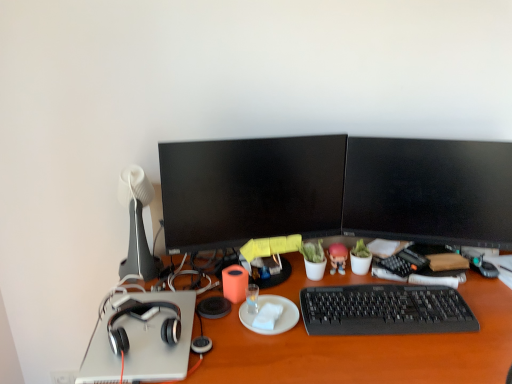
Image resolution: width=512 pixels, height=384 pixels. What do you see at coordinates (367, 350) in the screenshot?
I see `black matte headphones at left` at bounding box center [367, 350].

I want to click on black glossy monitor at right, which is counted as the 2th television, starting from the left, so click(x=429, y=191).

The width and height of the screenshot is (512, 384). Describe the element at coordinates (234, 283) in the screenshot. I see `orange matte cup at center` at that location.

Identify the location of orange matte cup at center. (234, 283).

Identify the location of black matte keyboard at lower right. pos(385,310).

From the image's perspective, which object appears higher, black matte keyboard at lower right or white matte plate at center?

black matte keyboard at lower right appears higher in the image.

Which is behind, point (345, 307) or point (266, 297)?

The point (266, 297) is farther.

Is black matte keyboard at lower right next to white matte plate at center and touching it?

black matte keyboard at lower right and white matte plate at center are not in contact.

Is black glossy monitor at center, the second television when ordered from right to left, inside the boundaries of white matte lamp at left, or outside?

black glossy monitor at center, the second television when ordered from right to left, is not inside white matte lamp at left, it's outside.

Consider the image. Considering the relative sizes of black glossy monitor at center, the second television when ordered from right to left, and white matte lamp at left in the image provided, is black glossy monitor at center, the second television when ordered from right to left, wider than white matte lamp at left?

Incorrect, the width of black glossy monitor at center, the second television when ordered from right to left, does not surpass that of white matte lamp at left.

Does point (125, 198) come in front of point (456, 318)?

That is False.

Is white matte lamp at left facing towards black matte keyboard at lower right?

No, white matte lamp at left is not aimed at black matte keyboard at lower right.

Are white matte lamp at left and black matte keyboard at lower right far apart?

Actually, white matte lamp at left and black matte keyboard at lower right are a little close together.

From a real-world perspective, which is physically below, white matte lamp at left or black matte keyboard at lower right?

black matte keyboard at lower right, from a real-world perspective.

Considering the relative sizes of black glossy monitor at center, the second television when ordered from right to left, and white matte plate at center in the image provided, is black glossy monitor at center, the second television when ordered from right to left, bigger than white matte plate at center?

Correct, black glossy monitor at center, the second television when ordered from right to left, is larger in size than white matte plate at center.

From the image's perspective, does black glossy monitor at center, the second television when ordered from right to left, appear lower than white matte plate at center?

Incorrect, from the image's perspective, black glossy monitor at center, the second television when ordered from right to left, is higher than white matte plate at center.

Does black glossy monitor at center, which is counted as the 1th television, starting from the left, turn towards white matte plate at center?

No, black glossy monitor at center, which is counted as the 1th television, starting from the left, is not aimed at white matte plate at center.

Is black glossy monitor at center, which is counted as the 1th television, starting from the left, in contact with white matte plate at center?

They are not placed beside each other.

Who is smaller, white matte notepad at center or black glossy monitor at center, the second television when ordered from right to left?

Smaller between the two is white matte notepad at center.

I want to click on the 1st television positioned above the white matte notepad at center (from the image's perspective), so click(250, 190).

From the image's perspective, relative to black glossy monitor at center, the second television when ordered from right to left, is white matte notepad at center above or below?

From the image's perspective, white matte notepad at center appears below black glossy monitor at center, the second television when ordered from right to left.

How different are the orientations of white matte notepad at center and black glossy monitor at center, the second television when ordered from right to left, in degrees?

37.1 degrees.

Is white matte lamp at left smaller than black matte headphones at left?

Incorrect, white matte lamp at left is not smaller in size than black matte headphones at left.

Is white matte lamp at left positioned far away from black matte headphones at left?

white matte lamp at left is actually quite close to black matte headphones at left.

Considering the relative positions of white matte lamp at left and black matte headphones at left in the image provided, is white matte lamp at left behind black matte headphones at left?

Yes, white matte lamp at left is further from the viewer.

Would you say white matte lamp at left is outside black matte headphones at left?

Yes.

From a real-world perspective, is orange matte cup at center on top of black matte headphones at left?

No.

Does orange matte cup at center contain black matte headphones at left?

No, black matte headphones at left is located outside of orange matte cup at center.

Which of these two, orange matte cup at center or black matte headphones at left, is bigger?

black matte headphones at left is bigger.

Find the location of a particular element. Image resolution: width=512 pixels, height=384 pixels. computer keyboard above the white matte plate at center (from the image's perspective) is located at coordinates (385, 310).

You are a GUI agent. You are given a task and a screenshot of the screen. Output one action in this format:
    pyautogui.click(x=<x>, y=<y>)
    Task: Click on the lamp that appears behind the black glossy monitor at center, which is counted as the 1th television, starting from the left
    The width and height of the screenshot is (512, 384).
    Given the screenshot: What is the action you would take?
    pyautogui.click(x=137, y=225)

Based on their spatial positions, is orange matte cup at center or white matte plate at center closer to black glossy monitor at right, arranged as the 1th television when viewed from the right?

white matte plate at center is closer to black glossy monitor at right, arranged as the 1th television when viewed from the right.

Looking at the image, which one is located closer to white matte lamp at left, white matte notepad at center or black matte headphones at left?

black matte headphones at left is positioned closer to the anchor white matte lamp at left.

Estimate the real-world distances between objects in this image. Which object is further from black glossy monitor at right, which is counted as the 2th television, starting from the left, black glossy monitor at center, which is counted as the 1th television, starting from the left, or white matte plate at center?

Among the two, white matte plate at center is located further to black glossy monitor at right, which is counted as the 2th television, starting from the left.

Which object lies nearer to the anchor point black glossy monitor at right, which is counted as the 2th television, starting from the left, pink glossy figurine at center or black glossy monitor at center, which is counted as the 1th television, starting from the left?

black glossy monitor at center, which is counted as the 1th television, starting from the left, lies closer to black glossy monitor at right, which is counted as the 2th television, starting from the left, than the other object.

Considering their positions, is black glossy monitor at center, the second television when ordered from right to left, positioned further to orange matte cup at center than black matte headphones at left?

The object further to orange matte cup at center is black glossy monitor at center, the second television when ordered from right to left.

From the picture: From the image, which object appears to be nearer to black glossy monitor at center, which is counted as the 1th television, starting from the left, black matte headphones at left or white matte lamp at left?

white matte lamp at left.

Estimate the real-world distances between objects in this image. Which object is further from black matte headphones at left, black glossy monitor at right, arranged as the 1th television when viewed from the right, or pink glossy figurine at center?

Among the two, black glossy monitor at right, arranged as the 1th television when viewed from the right, is located further to black matte headphones at left.

Considering their positions, is black glossy monitor at right, arranged as the 1th television when viewed from the right, positioned further to orange matte cup at center than white matte notepad at center?

black glossy monitor at right, arranged as the 1th television when viewed from the right, is further to orange matte cup at center.

Identify the location of desk located between orange matte cup at center and black matte keyboard at lower right in the left-right direction. (367, 350).

You are a GUI agent. You are given a task and a screenshot of the screen. Output one action in this format:
    pyautogui.click(x=<x>, y=<y>)
    Task: Click on the plate between orange matte cup at center and black matte headphones at left from left to right
    
    Given the screenshot: What is the action you would take?
    pyautogui.click(x=277, y=320)

Identify the location of stationery located between white matte lamp at left and black matte headphones at left in the left-right direction. Image resolution: width=512 pixels, height=384 pixels. (234, 283).

The height and width of the screenshot is (384, 512). Find the location of `notepad between black matte headphones at left and pink glossy figurine at center from front to back`. notepad between black matte headphones at left and pink glossy figurine at center from front to back is located at coordinates (267, 316).